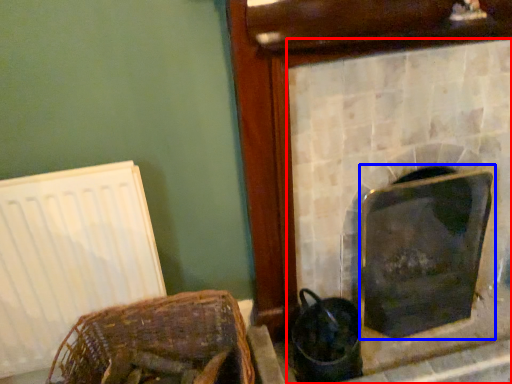
Question: Which object appears closest to the camera in this image, fireplace (highlighted by a red box) or fireplace (highlighted by a blue box)?

Choices:
 (A) fireplace
 (B) fireplace

Answer: (A)